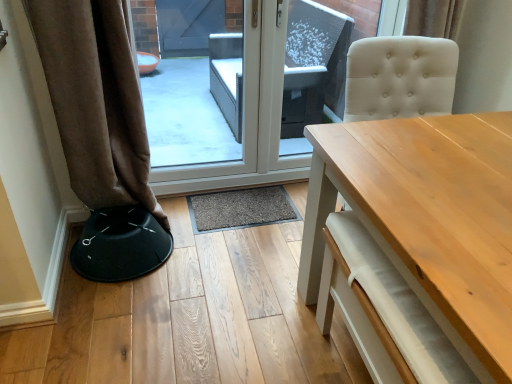
Question: Considering their positions, is black fabric bar stool at lower left located in front of or behind light wood table at center?

Choices:
 (A) behind
 (B) front

Answer: (A)

Question: Is black fabric bar stool at lower left bigger or smaller than light wood table at center?

Choices:
 (A) small
 (B) big

Answer: (A)

Question: Based on their relative distances, which object is nearer to the transparent glass door at center?

Choices:
 (A) brown fabric curtain at left
 (B) black fabric bar stool at lower left
 (C) beige tufted swivel chair at right
 (D) light wood table at center

Answer: (B)

Question: Which of these objects is positioned farthest from the beige tufted swivel chair at right?

Choices:
 (A) light wood table at center
 (B) transparent glass door at center
 (C) brown fabric curtain at left
 (D) black fabric bar stool at lower left

Answer: (D)